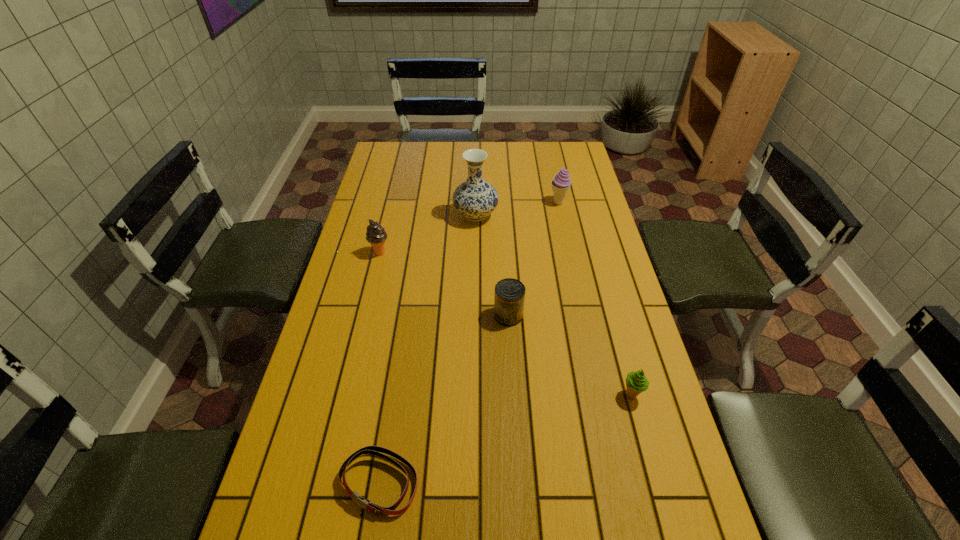
Find the location of a particular element. free spot located 0.230m on the back of the tallest object is located at coordinates (476, 170).

Where is `vacant area situated on the back of the farthest icecream`? vacant area situated on the back of the farthest icecream is located at coordinates (551, 166).

The image size is (960, 540). Find the location of `vacant point located on the back of the leftmost icecream`. vacant point located on the back of the leftmost icecream is located at coordinates (x=394, y=196).

Locate an element on the screen. The height and width of the screenshot is (540, 960). vacant space located 0.180m on the back of the rightmost icecream is located at coordinates (614, 330).

Identify the location of vacant region located on the front of the can. (515, 424).

Where is `vacant space situated 0.300m on the back of the shortest object`? vacant space situated 0.300m on the back of the shortest object is located at coordinates (400, 345).

Find the location of a particular element. The image size is (960, 540). icecream present at the left edge is located at coordinates (376, 235).

Where is `dog collar that is at the left edge`? This screenshot has width=960, height=540. dog collar that is at the left edge is located at coordinates (375, 450).

You are a GUI agent. You are given a task and a screenshot of the screen. Output one action in this format:
    pyautogui.click(x=<x>, y=<y>)
    Task: Click on the free space at the far edge of the desktop
    This screenshot has height=540, width=960.
    Given the screenshot: What is the action you would take?
    pyautogui.click(x=532, y=157)

Find the location of a particular element. The image size is (960, 540). free location at the left edge is located at coordinates [333, 427].